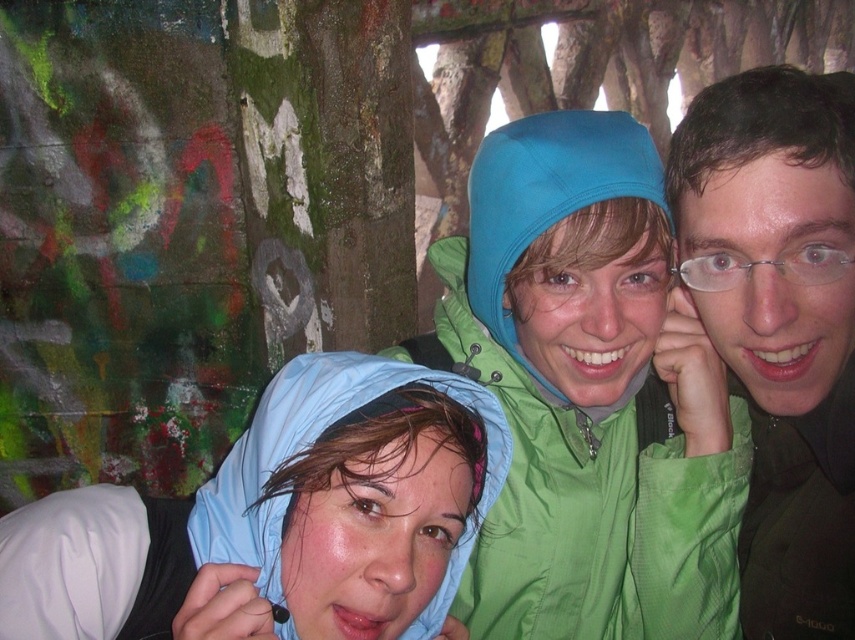
You are standing in front of the image and want to know how far the point at coordinates [423,394] is from you. Can you determine the distance?

The point at coordinates [423,394] is 11.36 feet away from the viewer.

You are standing in the room where the three people are posing. You need to place a small decorative item on the floor. The item must be placed between the two points labeled point (846, 611) and point (541, 420). Which point should the item be closer to in order to be between them?

The item should be closer to point (541, 420) because point (846, 611) is in front of point (541, 420).